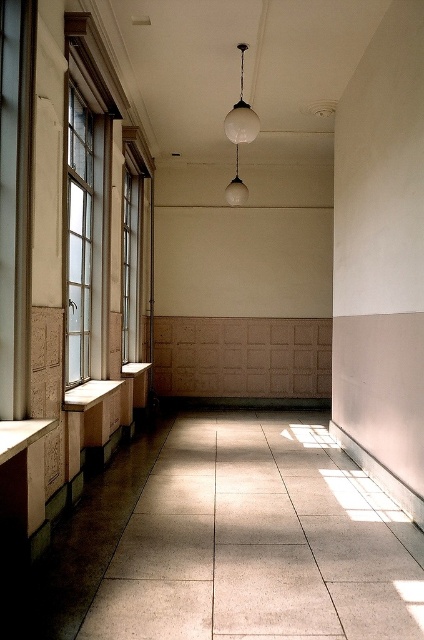
You are standing at the entrance of the corridor and want to take a photo. There are two points marked in the scene, point 1 at coordinates point (x=80, y=234) and point 2 at coordinates point (x=102, y=403). Which point is closer to your current position?

Point (x=80, y=234) is closer to the camera than point (x=102, y=403), so the point closer to your current position is point (x=80, y=234).